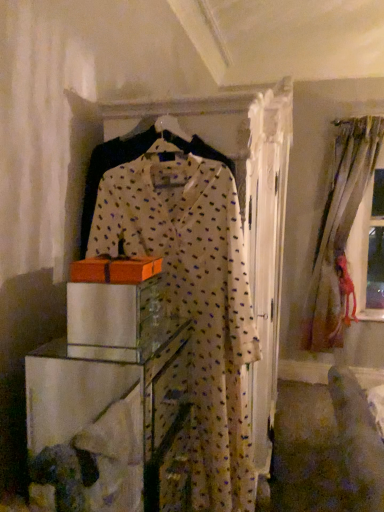
Find the location of a particular element. free space above orange cardboard box at center (from a real-world perspective) is located at coordinates (113, 263).